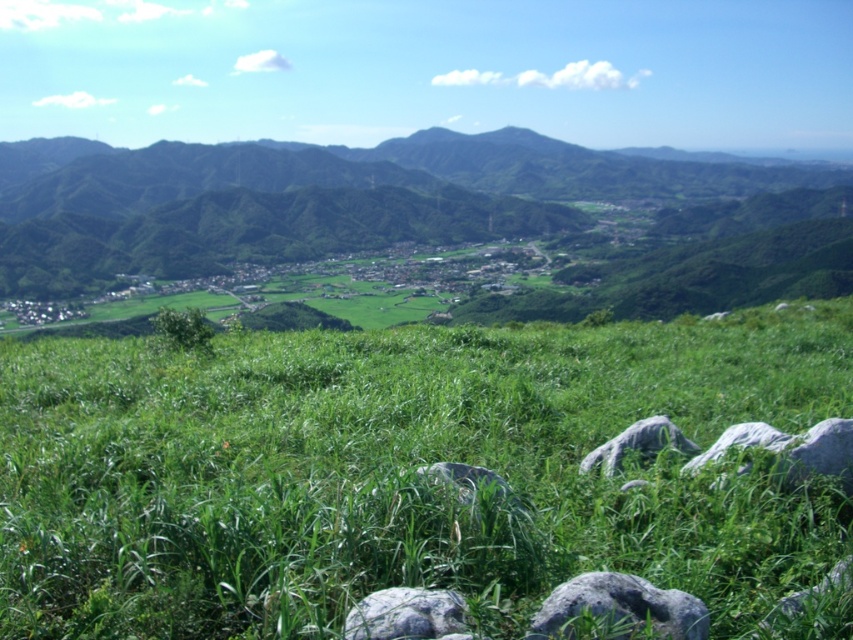
Who is more forward, (776, 532) or (750, 225)?

Point (776, 532) is more forward.

Which of these two, green grassy at center or green grassy hill at center, stands shorter?

With less height is green grassy at center.

Is point (689, 356) more distant than point (33, 177)?

No, (689, 356) is in front of (33, 177).

Identify the location of green grassy at center. The image size is (853, 640). click(402, 472).

Consider the image. Does green grassy hill at center have a lesser height compared to gray rough stone at lower center?

In fact, green grassy hill at center may be taller than gray rough stone at lower center.

From the picture: Does green grassy hill at center have a greater width compared to gray rough stone at lower center?

Indeed, green grassy hill at center has a greater width compared to gray rough stone at lower center.

Which is in front, point (24, 198) or point (352, 628)?

Point (352, 628) is more forward.

Locate an element on the screen. The image size is (853, 640). green grassy hill at center is located at coordinates (347, 198).

Does point (810, 392) come behind point (532, 616)?

Yes, it is behind point (532, 616).

Between point (3, 369) and point (645, 580), which one is positioned in front?

Point (645, 580) is more forward.

What are the coordinates of `green grassy at center` in the screenshot? It's located at (402, 472).